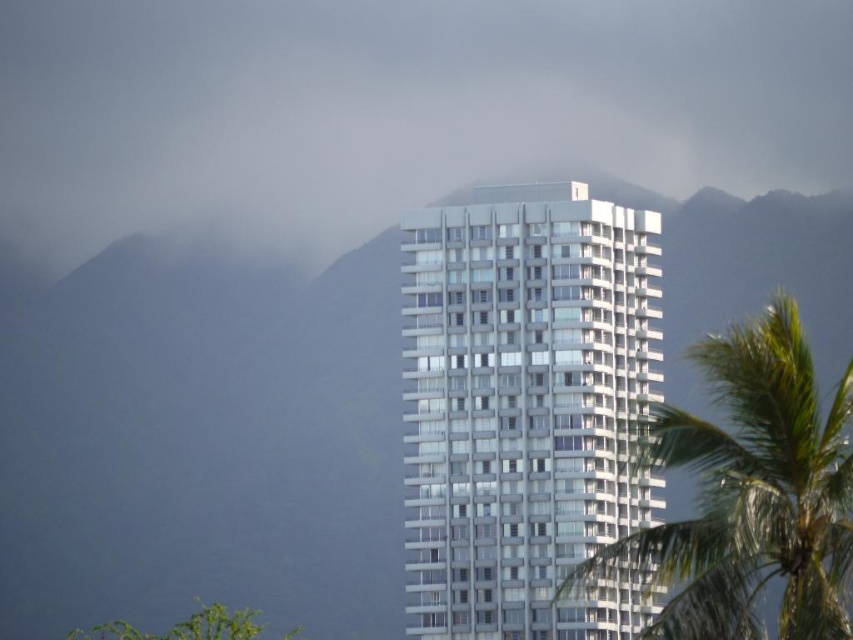
Question: Which point appears farthest from the camera in this image?

Choices:
 (A) (489, 616)
 (B) (198, 612)
 (C) (788, 340)

Answer: (B)

Question: Does transparent fog at center appear under gray matte mountain at center?

Choices:
 (A) no
 (B) yes

Answer: (A)

Question: Which of the following is the closest to the observer?

Choices:
 (A) gray matte mountain at center
 (B) green leafy tree at lower left
 (C) transparent fog at center

Answer: (B)

Question: Which point appears farthest from the camera in this image?

Choices:
 (A) (256, 612)
 (B) (682, 29)
 (C) (631, 189)

Answer: (B)

Question: Does transparent fog at center have a lesser width compared to white glass building at center?

Choices:
 (A) yes
 (B) no

Answer: (B)

Question: Does transparent fog at center appear on the right side of gray matte mountain at center?

Choices:
 (A) no
 (B) yes

Answer: (B)